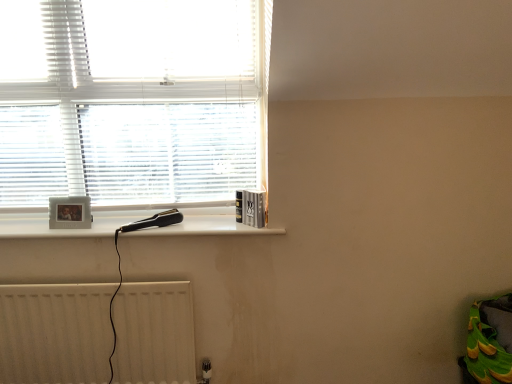
Question: From the image's perspective, is white textured blinds at upper left located above white plastic hairdryer at upper left?

Choices:
 (A) no
 (B) yes

Answer: (B)

Question: Considering the relative positions of white textured blinds at upper left and white plastic hairdryer at upper left in the image provided, is white textured blinds at upper left to the left of white plastic hairdryer at upper left from the viewer's perspective?

Choices:
 (A) yes
 (B) no

Answer: (A)

Question: From a real-world perspective, is white textured blinds at upper left located beneath white plastic hairdryer at upper left?

Choices:
 (A) no
 (B) yes

Answer: (A)

Question: Is white textured blinds at upper left thinner than white plastic hairdryer at upper left?

Choices:
 (A) yes
 (B) no

Answer: (A)

Question: Can you confirm if white textured blinds at upper left is shorter than white plastic hairdryer at upper left?

Choices:
 (A) yes
 (B) no

Answer: (B)

Question: From a real-world perspective, is white textured radiator at lower left above or below white plastic hairdryer at upper left?

Choices:
 (A) above
 (B) below

Answer: (B)

Question: Is white textured radiator at lower left wider or thinner than white plastic hairdryer at upper left?

Choices:
 (A) wide
 (B) thin

Answer: (B)

Question: Considering the positions of point (178, 311) and point (59, 235), is point (178, 311) closer or farther from the camera than point (59, 235)?

Choices:
 (A) farther
 (B) closer

Answer: (A)

Question: Is white textured radiator at lower left in front of or behind white plastic hairdryer at upper left in the image?

Choices:
 (A) behind
 (B) front

Answer: (B)

Question: Looking at their shapes, would you say white plastic hairdryer at upper left is wider or thinner than white textured radiator at lower left?

Choices:
 (A) thin
 (B) wide

Answer: (B)

Question: Is white plastic hairdryer at upper left taller or shorter than white textured radiator at lower left?

Choices:
 (A) tall
 (B) short

Answer: (B)

Question: Which is correct: white plastic hairdryer at upper left is inside white textured radiator at lower left, or outside of it?

Choices:
 (A) outside
 (B) inside

Answer: (A)

Question: Considering their positions, is white plastic hairdryer at upper left located in front of or behind white textured radiator at lower left?

Choices:
 (A) behind
 (B) front

Answer: (A)

Question: Looking at their shapes, would you say white textured radiator at lower left is wider or thinner than white textured blinds at upper left?

Choices:
 (A) wide
 (B) thin

Answer: (B)

Question: From a real-world perspective, is white textured radiator at lower left positioned above or below white textured blinds at upper left?

Choices:
 (A) above
 (B) below

Answer: (B)